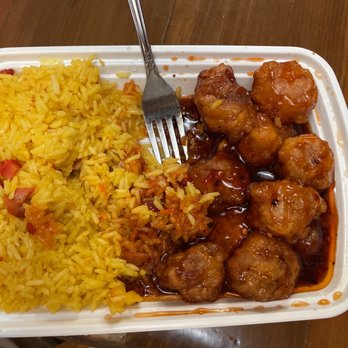
Locate an element on the screen. This screenshot has height=348, width=348. edge of serving tray is located at coordinates (176, 325).